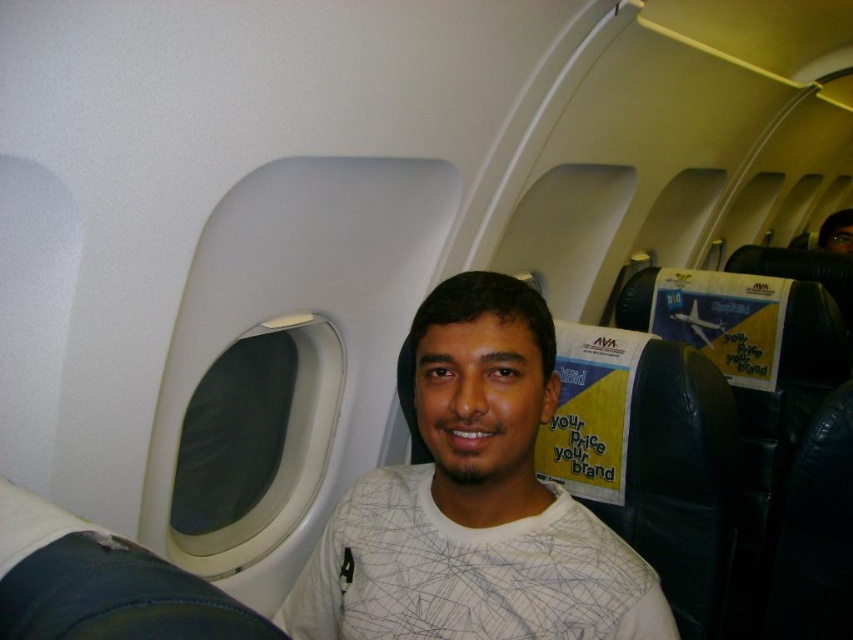
Question: Which point is farther to the camera?

Choices:
 (A) (79, 604)
 (B) (695, 307)

Answer: (B)

Question: Based on their relative distances, which object is nearer to the metallic airplane at upper right?

Choices:
 (A) white matte shirt at center
 (B) denim at left

Answer: (A)

Question: Can you confirm if white matte shirt at center is positioned to the left of denim at left?

Choices:
 (A) no
 (B) yes

Answer: (A)

Question: Which of the following is the farthest from the observer?

Choices:
 (A) (216, 630)
 (B) (706, 342)
 (C) (338, 621)

Answer: (B)

Question: From the image, what is the correct spatial relationship of white matte shirt at center in relation to metallic airplane at upper right?

Choices:
 (A) right
 (B) left

Answer: (B)

Question: Does white matte shirt at center have a smaller size compared to metallic airplane at upper right?

Choices:
 (A) no
 (B) yes

Answer: (A)